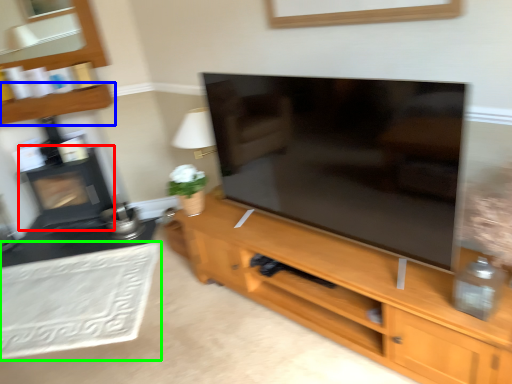
Question: Which object is the closest to the fireplace (highlighted by a red box)? Choose among these: shelf (highlighted by a blue box) or plain (highlighted by a green box).

Choices:
 (A) shelf
 (B) plain

Answer: (A)